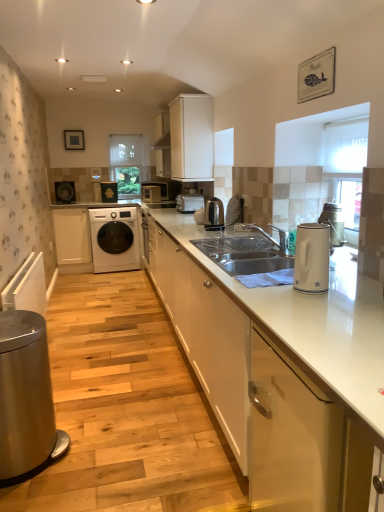
Question: Does white glossy electric kettle at right, the 1th home appliance positioned from the front, have a lesser width compared to white glossy microwave at center, acting as the 1th appliance starting from the back?

Choices:
 (A) yes
 (B) no

Answer: (A)

Question: Is white glossy microwave at center, arranged as the fourth appliance when viewed from the front, at the back of white glossy electric kettle at right, the 1th home appliance positioned from the front?

Choices:
 (A) no
 (B) yes

Answer: (A)

Question: Does white glossy electric kettle at right, the 1th home appliance positioned from the front, have a greater width compared to white glossy microwave at center, the third appliance viewed from the right?

Choices:
 (A) yes
 (B) no

Answer: (B)

Question: Is white glossy electric kettle at right, marked as the 2th home appliance in a bottom-to-top arrangement, positioned far away from white glossy microwave at center, which is the 2th appliance from left to right?

Choices:
 (A) no
 (B) yes

Answer: (B)

Question: Does white glossy electric kettle at right, the 1th home appliance positioned from the front, have a smaller size compared to white glossy microwave at center, which is the 2th appliance from left to right?

Choices:
 (A) no
 (B) yes

Answer: (B)

Question: Considering their positions, is transparent glass window at center, the second window screen in the right-to-left sequence, located in front of or behind white textured blinds at upper right, positioned as the 1th window screen in front-to-back order?

Choices:
 (A) front
 (B) behind

Answer: (B)

Question: Considering the positions of point (137, 192) and point (332, 190), is point (137, 192) closer or farther from the camera than point (332, 190)?

Choices:
 (A) closer
 (B) farther

Answer: (B)

Question: Is transparent glass window at center, which ranks as the first window screen in top-to-bottom order, bigger or smaller than white textured blinds at upper right, the 1th window screen ordered from the bottom?

Choices:
 (A) small
 (B) big

Answer: (B)

Question: Considering the positions of transparent glass window at center, which is counted as the first window screen, starting from the back, and white textured blinds at upper right, the 1th window screen ordered from the bottom, in the image, is transparent glass window at center, which is counted as the first window screen, starting from the back, wider or thinner than white textured blinds at upper right, the 1th window screen ordered from the bottom,?

Choices:
 (A) wide
 (B) thin

Answer: (A)

Question: Looking at the image, does white matte cabinet at upper center, arranged as the 2th cabinetry when viewed from the back, seem bigger or smaller compared to transparent glass window at center, which is the second window screen in front-to-back order?

Choices:
 (A) big
 (B) small

Answer: (A)

Question: Considering the positions of white matte cabinet at upper center, acting as the third cabinetry starting from the right, and transparent glass window at center, the first window screen in the left-to-right sequence, in the image, is white matte cabinet at upper center, acting as the third cabinetry starting from the right, taller or shorter than transparent glass window at center, the first window screen in the left-to-right sequence,?

Choices:
 (A) tall
 (B) short

Answer: (B)

Question: From the image's perspective, is white matte cabinet at upper center, placed as the third cabinetry when sorted from front to back, above or below transparent glass window at center, which is counted as the first window screen, starting from the back?

Choices:
 (A) above
 (B) below

Answer: (B)

Question: Is point (183, 129) positioned closer to the camera than point (122, 180)?

Choices:
 (A) closer
 (B) farther

Answer: (A)

Question: From a real-world perspective, is matte black washing machine at left, positioned as the 3th appliance in back-to-front order, positioned above or below white glossy cabinet at lower right, which ranks as the 4th cabinetry in back-to-front order?

Choices:
 (A) above
 (B) below

Answer: (A)

Question: Is matte black washing machine at left, the second appliance from the front, taller or shorter than white glossy cabinet at lower right, which appears as the first cabinetry when viewed from the right?

Choices:
 (A) short
 (B) tall

Answer: (A)